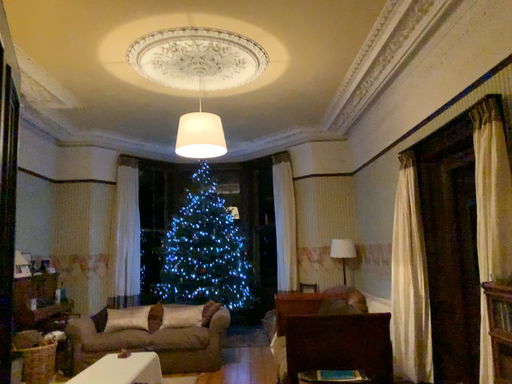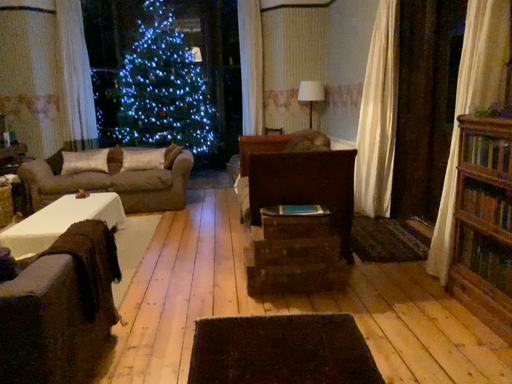
Question: How did the camera likely rotate when shooting the video?

Choices:
 (A) rotated upward
 (B) rotated downward

Answer: (B)